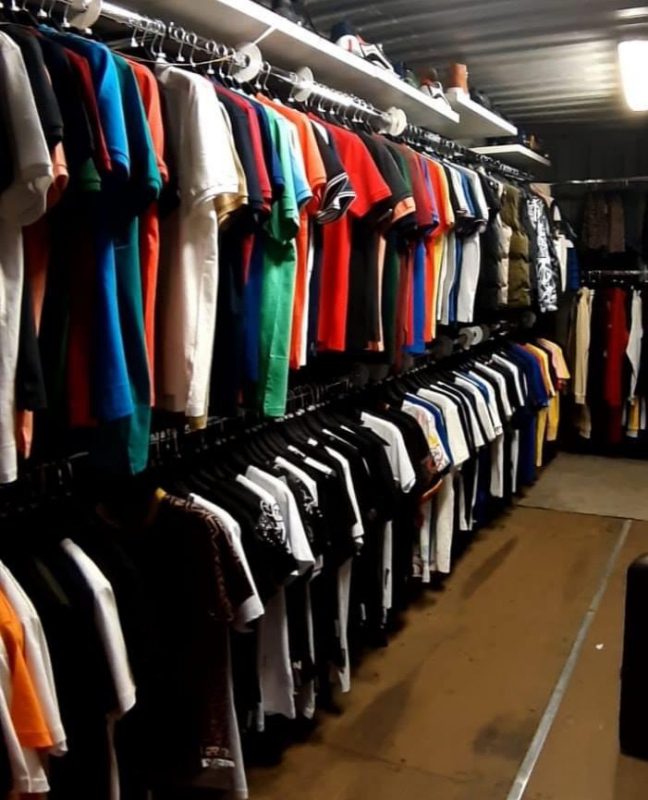
This screenshot has height=800, width=648. Identify the location of shelf. (218, 18), (470, 128), (343, 62), (422, 106), (514, 158).